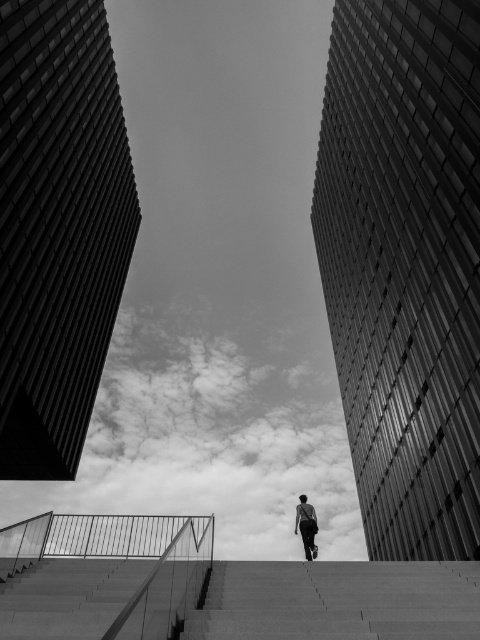
You are standing at the bottom of the smooth concrete stairs at center and want to reach the dark gray fabric man at center who is walking up the stairs. Which direction should you move to catch up with them?

The smooth concrete stairs at center is to the left of dark gray fabric man at center, so you should move to your right to catch up with them.

You are standing at the bottom of the smooth concrete stairs at center in the image. Looking up, you see two tall modern buildings framing the scene. Which direction should you walk to exit the scene towards the open sky?

Since the smooth concrete stairs at center are positioned at coordinates approximately 0.939 in the x and 0.706 in the y, walking upwards along the stairs would lead towards the open sky above the buildings. The stairs are central, so moving forward up them would exit the scene towards the sky.

You are standing at the bottom of the smooth concrete stairs at center and want to walk up to the top. Considering the dark gray fabric man at center is already halfway up the stairs, how much wider are the stairs compared to the man?

The smooth concrete stairs at center are wider than the dark gray fabric man at center. The exact measurement isn